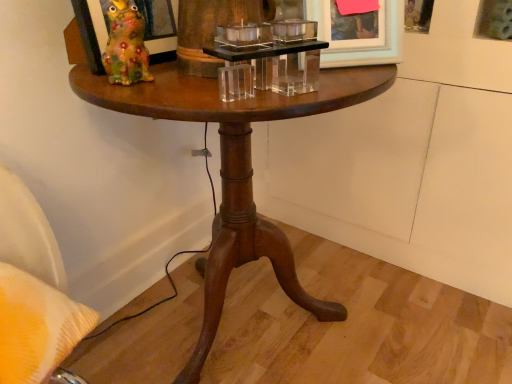
Image resolution: width=512 pixels, height=384 pixels. Identify the location of free region under clear acrylic candle holder at center (from a real-world perspective). (242, 93).